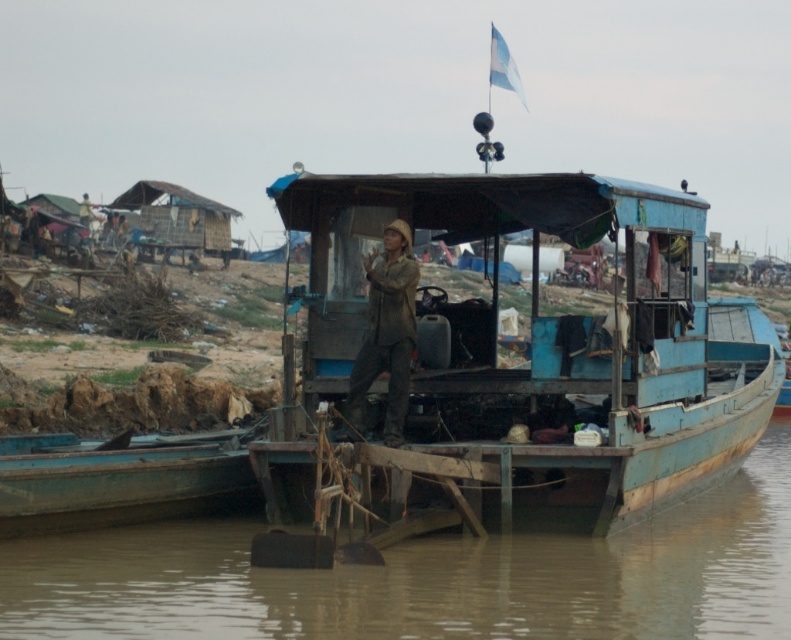
Question: Does wooden boat at lower left appear over brown fabric hat at center?

Choices:
 (A) yes
 (B) no

Answer: (B)

Question: Does brown wooden river at center have a larger size compared to wooden boat at lower left?

Choices:
 (A) yes
 (B) no

Answer: (A)

Question: Which point is farther to the camera?

Choices:
 (A) brown fabric hat at center
 (B) brown wooden river at center
 (C) blue matte boat at center

Answer: (A)

Question: Which of the following is the closest to the observer?

Choices:
 (A) blue matte boat at center
 (B) wooden boat at lower left
 (C) brown fabric hat at center

Answer: (A)

Question: Which object appears closest to the camera in this image?

Choices:
 (A) brown fabric hat at center
 (B) wooden boat at lower left
 (C) brown wooden river at center
 (D) blue matte boat at center

Answer: (C)

Question: Can you confirm if blue matte boat at center is positioned to the left of brown fabric hat at center?

Choices:
 (A) yes
 (B) no

Answer: (B)